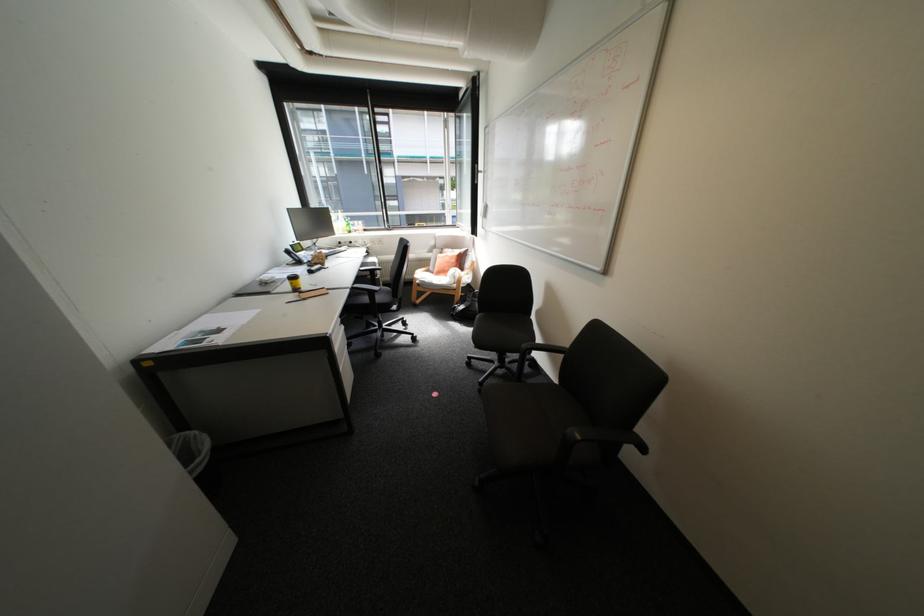
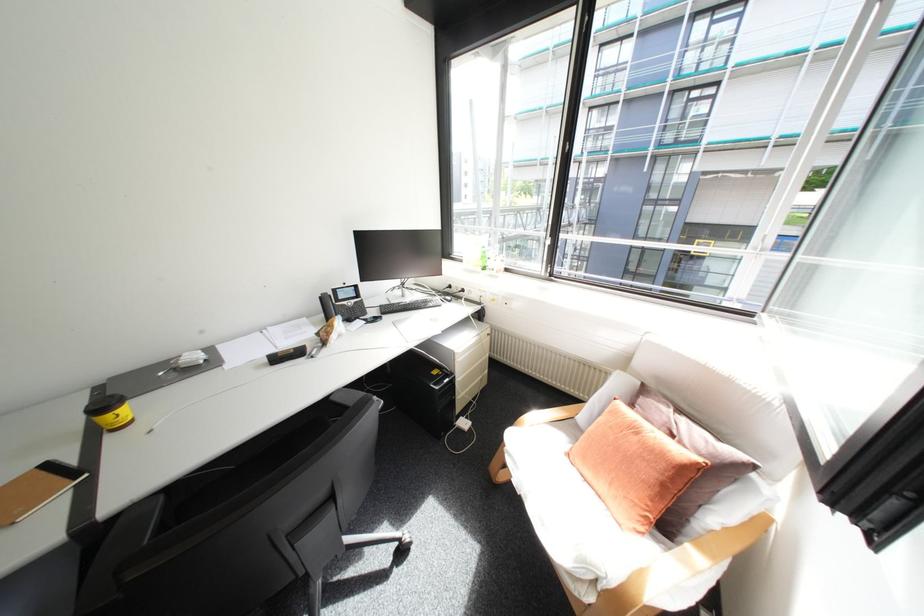
Find the pixel in the second image that matches point (294, 251) in the first image.

(330, 296)